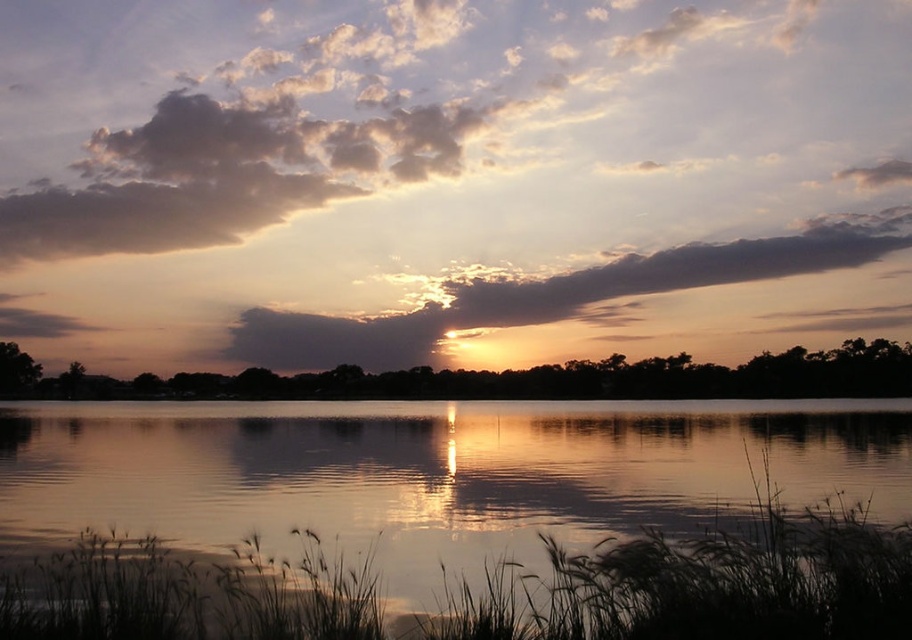
Measure the distance between silvery reflective water at center and camera.

A distance of 10.17 meters exists between silvery reflective water at center and camera.

Which is more to the left, silvery reflective water at center or smokey gray cloud at upper center?

From the viewer's perspective, silvery reflective water at center appears more on the left side.

What do you see at coordinates (486, 490) in the screenshot? I see `silvery reflective water at center` at bounding box center [486, 490].

Identify the location of silvery reflective water at center. The width and height of the screenshot is (912, 640). (486, 490).

Between cloudy sky at upper center and smokey gray cloud at upper center, which one appears on the right side from the viewer's perspective?

smokey gray cloud at upper center

Which is below, cloudy sky at upper center or smokey gray cloud at upper center?

Positioned lower is smokey gray cloud at upper center.

What do you see at coordinates (451, 179) in the screenshot? This screenshot has width=912, height=640. I see `cloudy sky at upper center` at bounding box center [451, 179].

This screenshot has width=912, height=640. In order to click on cloudy sky at upper center in this screenshot , I will do `click(451, 179)`.

Who is more forward, [668,257] or [163,417]?

Point [163,417] is more forward.

Who is more forward, (493, 298) or (707, 515)?

Point (707, 515) is in front.

Identify the location of cloudy sky at upper center. The width and height of the screenshot is (912, 640). (451, 179).